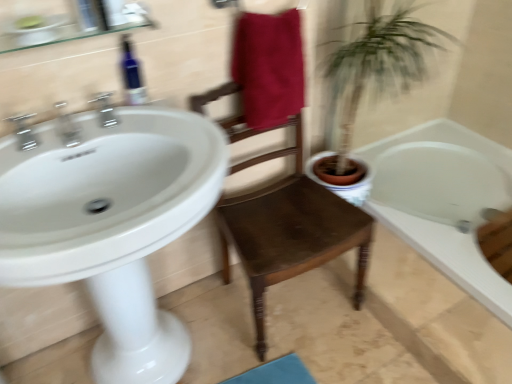
Find the location of `free space between chrome metallic faucet at upper left, which appears as the 3th tap when viewed from the right, and chrome metallic faucet at upper left, acting as the 2th tap starting from the left`. free space between chrome metallic faucet at upper left, which appears as the 3th tap when viewed from the right, and chrome metallic faucet at upper left, acting as the 2th tap starting from the left is located at coordinates (51, 146).